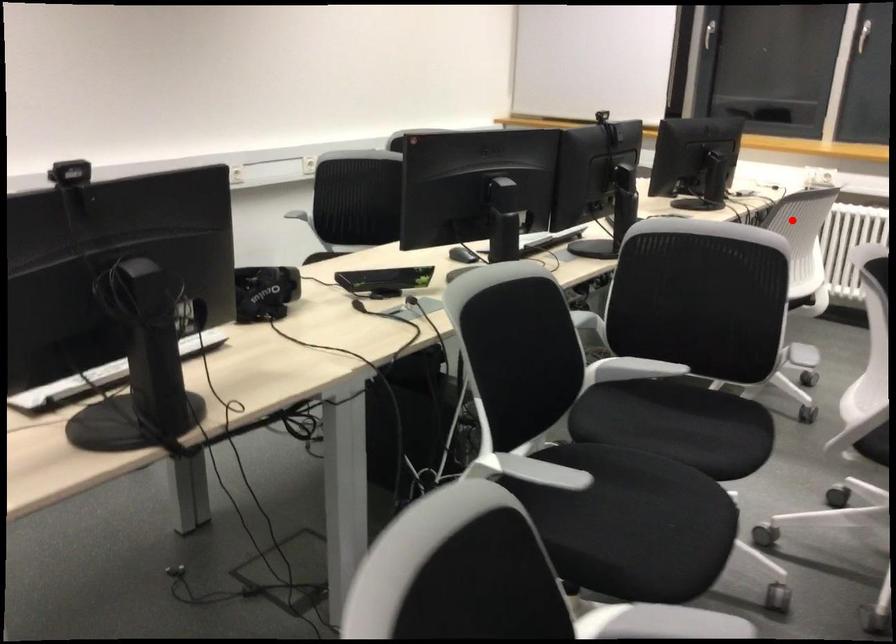
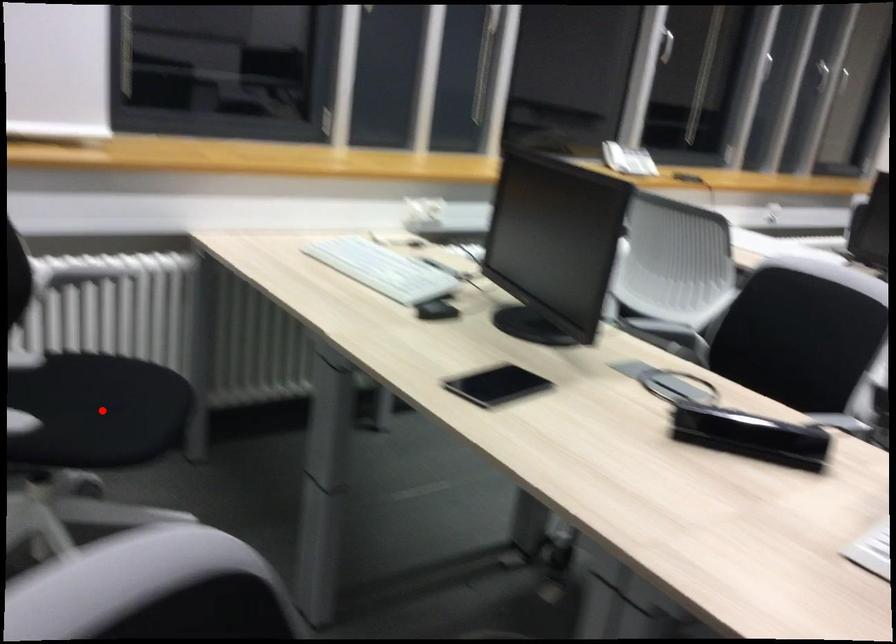
I am providing you with two images of the same scene from different viewpoints. A red point is marked on the first image and another point is marked on the second image. Do the highlighted points in image1 and image2 indicate the same real-world spot?

No